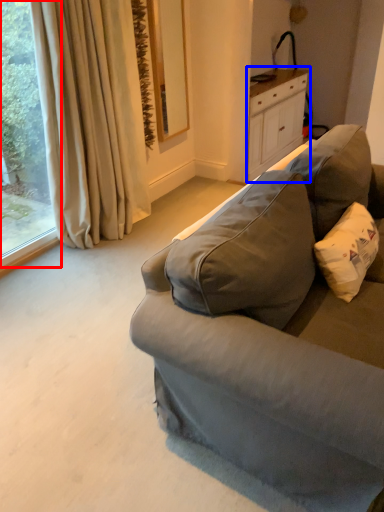
Question: Which object appears closest to the camera in this image, window (highlighted by a red box) or cabinetry (highlighted by a blue box)?

Choices:
 (A) window
 (B) cabinetry

Answer: (A)